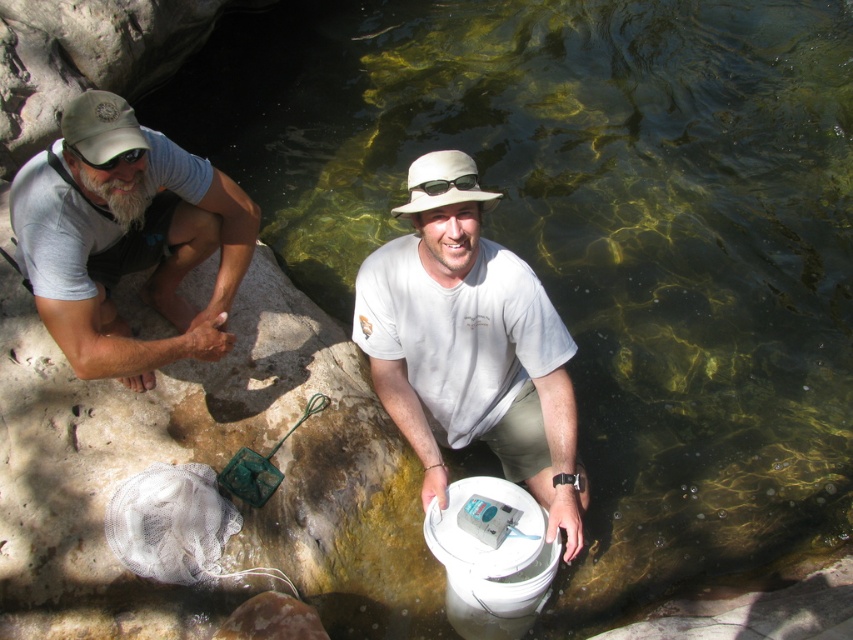
Which is more to the right, white matte shirt at center or matte gray shirt at left?

white matte shirt at center

Can you confirm if white matte shirt at center is thinner than matte gray shirt at left?

In fact, white matte shirt at center might be wider than matte gray shirt at left.

At what (x,y) coordinates should I click in order to perform the action: click on white matte shirt at center. Please return your answer as a coordinate pair (x, y). Looking at the image, I should click on (469, 344).